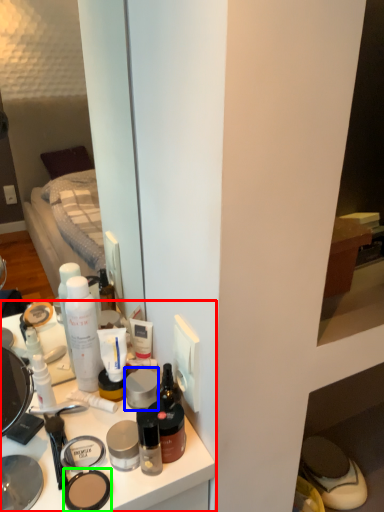
Question: Considering the real-world distances, which object is closest to desk (highlighted by a red box)? face powder (highlighted by a blue box) or face powder (highlighted by a green box).

Choices:
 (A) face powder
 (B) face powder

Answer: (B)